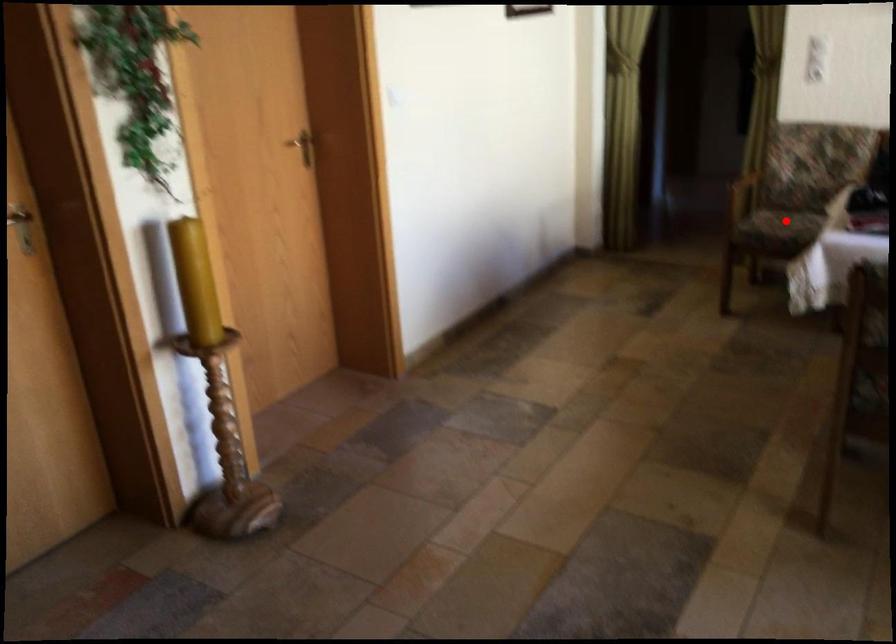
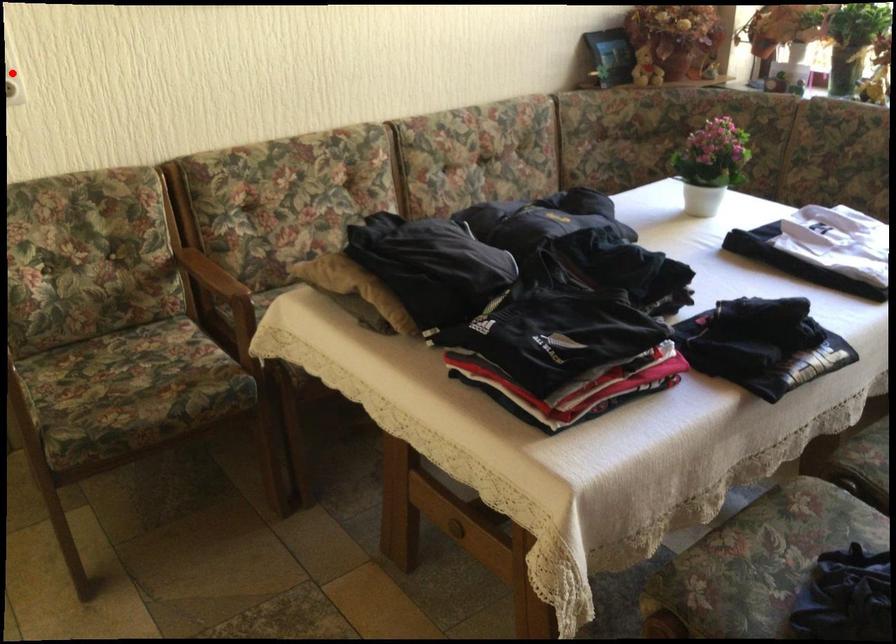
I am providing you with two images of the same scene from different viewpoints. A red point is marked on the first image and another point is marked on the second image. Does the point marked in image1 correspond to the same location as the one in image2?

No